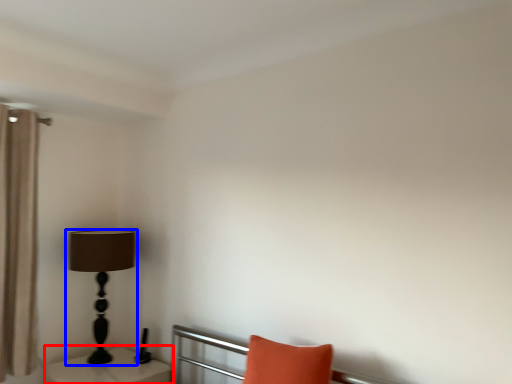
Question: Which of the following is the closest to the observer, table (highlighted by a red box) or lamp (highlighted by a blue box)?

Choices:
 (A) table
 (B) lamp

Answer: (A)